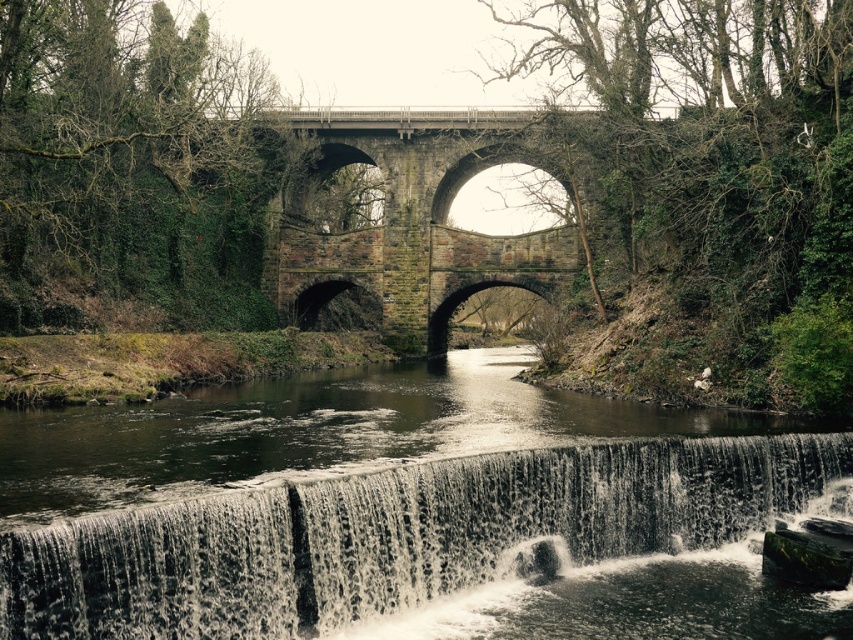
Who is more distant from viewer, [260,492] or [302,116]?

Point [302,116]

Does dark gray textured water at lower center have a lesser width compared to stone arch bridge at center?

Yes, dark gray textured water at lower center is thinner than stone arch bridge at center.

Measure the distance between point [612,529] and camera.

Point [612,529] is 46.78 meters away from camera.

Find the location of a particular element. dark gray textured water at lower center is located at coordinates (397, 536).